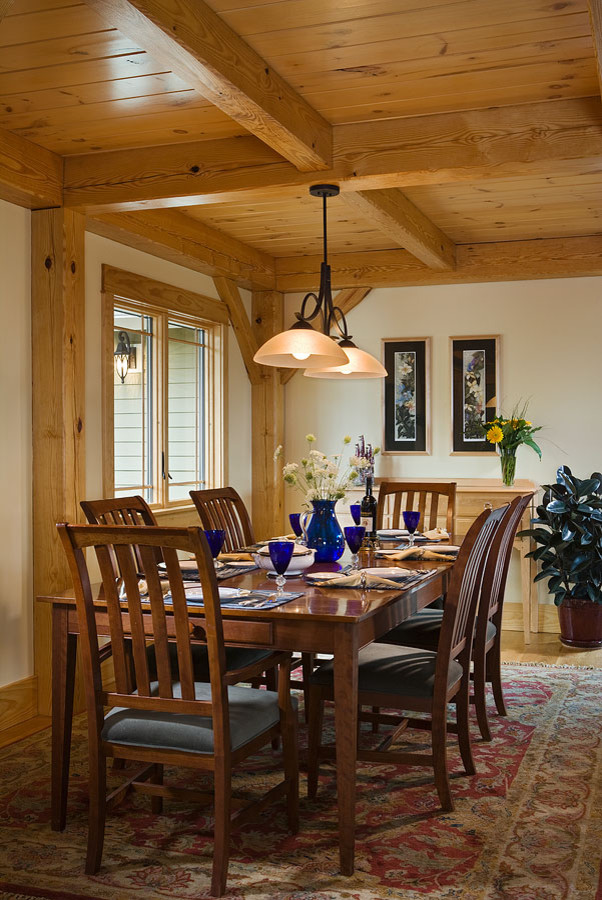
Image resolution: width=602 pixels, height=900 pixels. In order to click on chair in this screenshot , I will do `click(166, 712)`, `click(125, 511)`, `click(219, 502)`, `click(426, 502)`, `click(504, 544)`, `click(456, 621)`.